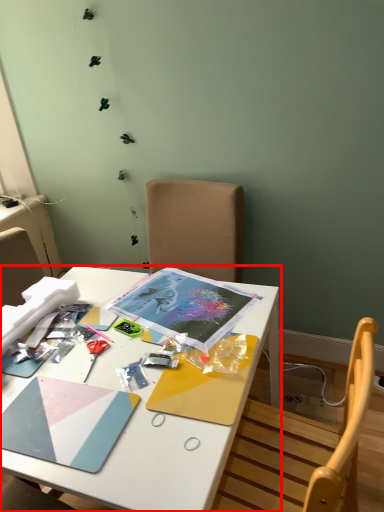
Question: From the image's perspective, what is the correct spatial relationship of desk (annotated by the red box) in relation to scissors?

Choices:
 (A) above
 (B) below

Answer: (B)